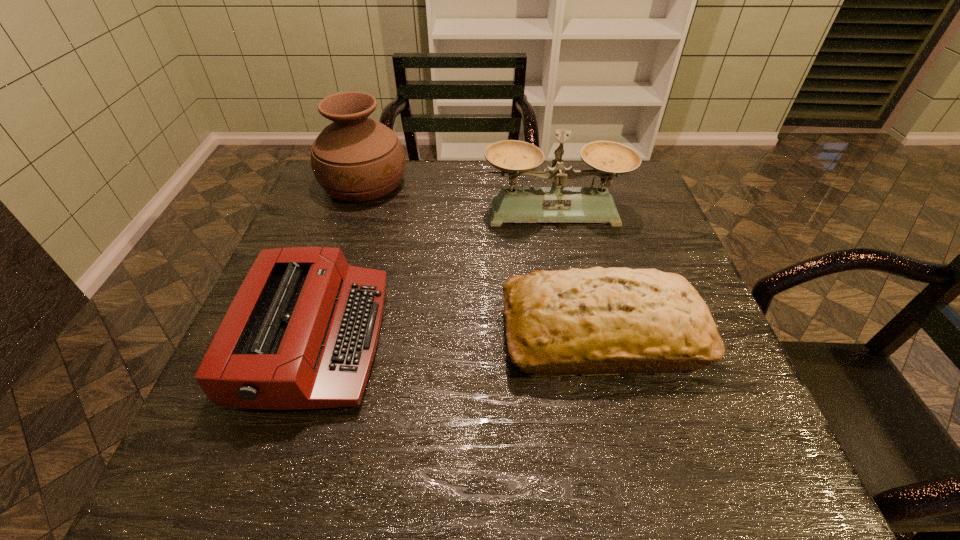
Where is `vacant region that satisfies the following two spatial constraints: 1. on the front-facing side of the bread; 2. on the right side of the scale`? This screenshot has height=540, width=960. vacant region that satisfies the following two spatial constraints: 1. on the front-facing side of the bread; 2. on the right side of the scale is located at coordinates (579, 335).

What are the coordinates of `vacant area in the image that satisfies the following two spatial constraints: 1. on the front-facing side of the scale; 2. on the typing side of the typewriter` in the screenshot? It's located at (580, 339).

Find the location of `free space that satisfies the following two spatial constraints: 1. on the front-facing side of the scale; 2. on the typing side of the shortest object`. free space that satisfies the following two spatial constraints: 1. on the front-facing side of the scale; 2. on the typing side of the shortest object is located at coordinates (580, 339).

Identify the location of vacant space that satisfies the following two spatial constraints: 1. on the front-facing side of the scale; 2. on the typing side of the typewriter. Image resolution: width=960 pixels, height=540 pixels. (580, 339).

I want to click on free spot that satisfies the following two spatial constraints: 1. on the front-facing side of the scale; 2. on the right side of the bread, so click(579, 335).